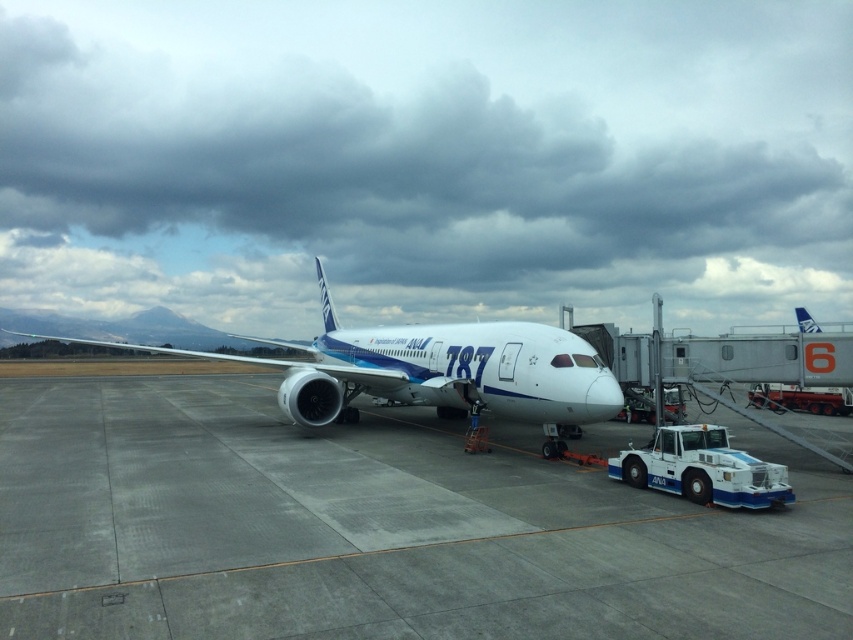
Is cloudy sky at upper center below gray concrete tarmac at center?

No, cloudy sky at upper center is not below gray concrete tarmac at center.

Does cloudy sky at upper center have a greater width compared to gray concrete tarmac at center?

Yes, cloudy sky at upper center is wider than gray concrete tarmac at center.

This screenshot has width=853, height=640. What are the coordinates of `cloudy sky at upper center` in the screenshot? It's located at click(427, 160).

Is the position of cloudy sky at upper center less distant than that of white glossy airplane at center?

That is False.

Identify the location of cloudy sky at upper center. (427, 160).

Which of these two, gray concrete tarmac at center or white glossy airplane at center, stands taller?

white glossy airplane at center

Does gray concrete tarmac at center appear on the right side of white glossy airplane at center?

Indeed, gray concrete tarmac at center is positioned on the right side of white glossy airplane at center.

You are a GUI agent. You are given a task and a screenshot of the screen. Output one action in this format:
    pyautogui.click(x=<x>, y=<y>)
    Task: Click on the gray concrete tarmac at center
    The width and height of the screenshot is (853, 640).
    Given the screenshot: What is the action you would take?
    pyautogui.click(x=375, y=529)